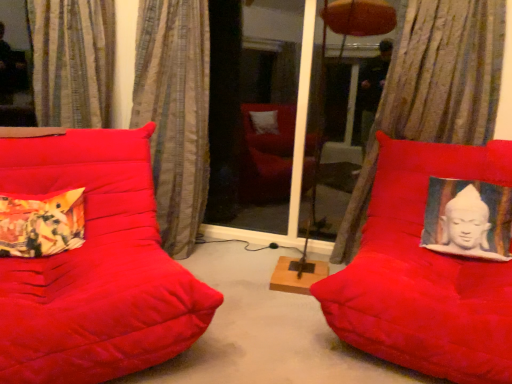
Question: From the image's perspective, is textured beige curtain at left, which is counted as the second curtain, starting from the right, beneath striped fabric curtain at upper left, arranged as the 3th curtain when viewed from the right?

Choices:
 (A) no
 (B) yes

Answer: (B)

Question: Is textured beige curtain at left, which is the 2th curtain in left-to-right order, oriented towards striped fabric curtain at upper left, the 1th curtain positioned from the left?

Choices:
 (A) yes
 (B) no

Answer: (B)

Question: Would you consider textured beige curtain at left, which is counted as the second curtain, starting from the right, to be distant from striped fabric curtain at upper left, the 1th curtain positioned from the left?

Choices:
 (A) no
 (B) yes

Answer: (A)

Question: From a real-world perspective, is textured beige curtain at left, which is the 2th curtain in left-to-right order, under striped fabric curtain at upper left, arranged as the 3th curtain when viewed from the right?

Choices:
 (A) no
 (B) yes

Answer: (B)

Question: Considering the relative sizes of textured beige curtain at left, which is counted as the second curtain, starting from the right, and striped fabric curtain at upper left, arranged as the 3th curtain when viewed from the right, in the image provided, is textured beige curtain at left, which is counted as the second curtain, starting from the right, thinner than striped fabric curtain at upper left, arranged as the 3th curtain when viewed from the right,?

Choices:
 (A) yes
 (B) no

Answer: (B)

Question: From a real-world perspective, is suede red cushion at right, the first furniture viewed from the right, above or below textured beige curtain at upper right, positioned as the 3th curtain in left-to-right order?

Choices:
 (A) above
 (B) below

Answer: (B)

Question: In the image, is suede red cushion at right, positioned as the 2th furniture in left-to-right order, on the left side or the right side of textured beige curtain at upper right, positioned as the 3th curtain in left-to-right order?

Choices:
 (A) left
 (B) right

Answer: (A)

Question: Is suede red cushion at right, the first furniture viewed from the right, inside the boundaries of textured beige curtain at upper right, positioned as the 3th curtain in left-to-right order, or outside?

Choices:
 (A) inside
 (B) outside

Answer: (B)

Question: Based on their sizes in the image, would you say suede red cushion at right, the first furniture viewed from the right, is bigger or smaller than textured beige curtain at upper right, positioned as the 3th curtain in left-to-right order?

Choices:
 (A) small
 (B) big

Answer: (B)

Question: In the image, is transparent glass screen door at center on the left side or the right side of suede red cushion at right, positioned as the 2th furniture in left-to-right order?

Choices:
 (A) left
 (B) right

Answer: (A)

Question: In the image, is transparent glass screen door at center positioned in front of or behind suede red cushion at right, the first furniture viewed from the right?

Choices:
 (A) front
 (B) behind

Answer: (B)

Question: From the image's perspective, is transparent glass screen door at center above or below suede red cushion at right, the first furniture viewed from the right?

Choices:
 (A) below
 (B) above

Answer: (B)

Question: Is transparent glass screen door at center inside the boundaries of suede red cushion at right, the first furniture viewed from the right, or outside?

Choices:
 (A) inside
 (B) outside

Answer: (B)

Question: From a real-world perspective, is textured beige curtain at upper right, positioned as the 3th curtain in left-to-right order, above or below floral fabric cushion at left?

Choices:
 (A) above
 (B) below

Answer: (A)

Question: In terms of width, does textured beige curtain at upper right, which is the 1th curtain in right-to-left order, look wider or thinner when compared to floral fabric cushion at left?

Choices:
 (A) wide
 (B) thin

Answer: (A)